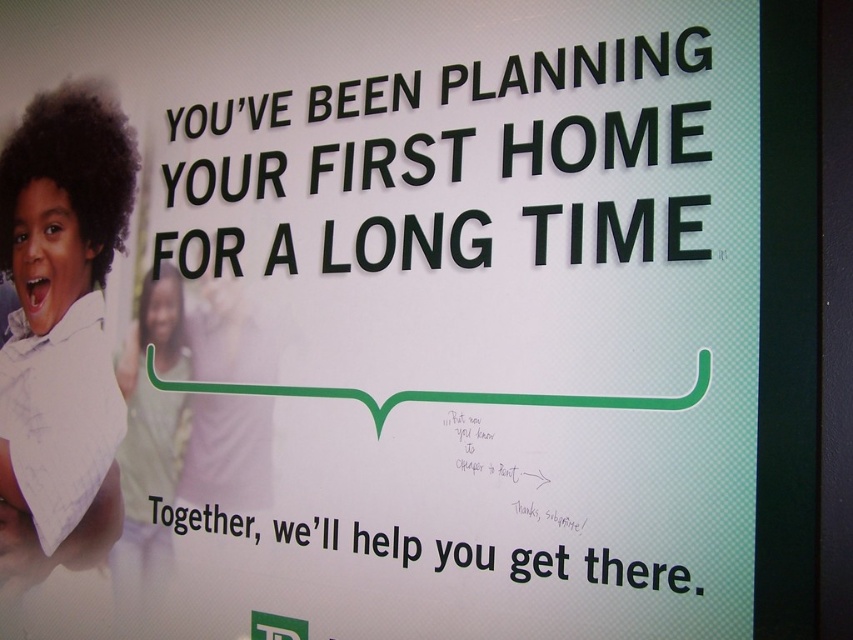
You are standing in front of the advertisement and want to touch both the point at coordinates (108, 440) and the point at coordinates (677, 141). Which point should you reach for first to touch the one closer to you?

You should first touch the point at coordinates (108, 440) because it is closer to you than the point at coordinates (677, 141).